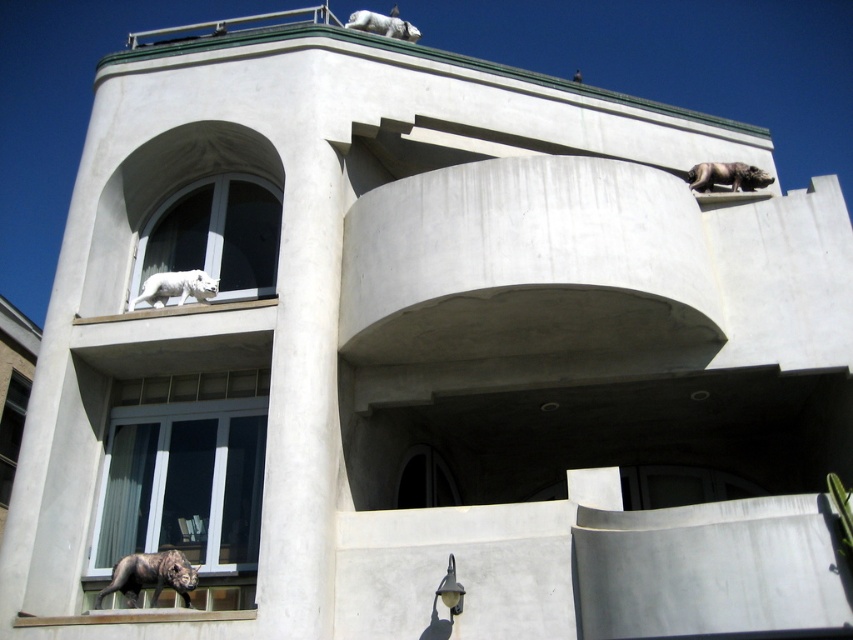
Is transparent glass window at lower center to the right of shiny black statue at lower left from the viewer's perspective?

In fact, transparent glass window at lower center is to the left of shiny black statue at lower left.

Between transparent glass window at lower center and shiny black statue at lower left, which one appears on the left side from the viewer's perspective?

transparent glass window at lower center

Is point (187, 500) positioned behind point (175, 589)?

That is True.

You are a GUI agent. You are given a task and a screenshot of the screen. Output one action in this format:
    pyautogui.click(x=<x>, y=<y>)
    Task: Click on the transparent glass window at lower center
    The width and height of the screenshot is (853, 640).
    Given the screenshot: What is the action you would take?
    pyautogui.click(x=184, y=483)

Does transparent glass window at lower center have a greater height compared to white marble window at center?

Yes, transparent glass window at lower center is taller than white marble window at center.

Who is higher up, transparent glass window at lower center or white marble window at center?

Positioned higher is white marble window at center.

Find the location of a particular element. The image size is (853, 640). transparent glass window at lower center is located at coordinates (184, 483).

The height and width of the screenshot is (640, 853). I want to click on transparent glass window at lower center, so click(184, 483).

Does transparent glass window at lower left have a greater width compared to gray stone elephant at upper right?

Incorrect, transparent glass window at lower left's width does not surpass gray stone elephant at upper right's.

Who is shorter, transparent glass window at lower left or gray stone elephant at upper right?

With less height is transparent glass window at lower left.

The width and height of the screenshot is (853, 640). Describe the element at coordinates (10, 429) in the screenshot. I see `transparent glass window at lower left` at that location.

This screenshot has height=640, width=853. I want to click on transparent glass window at lower left, so click(10, 429).